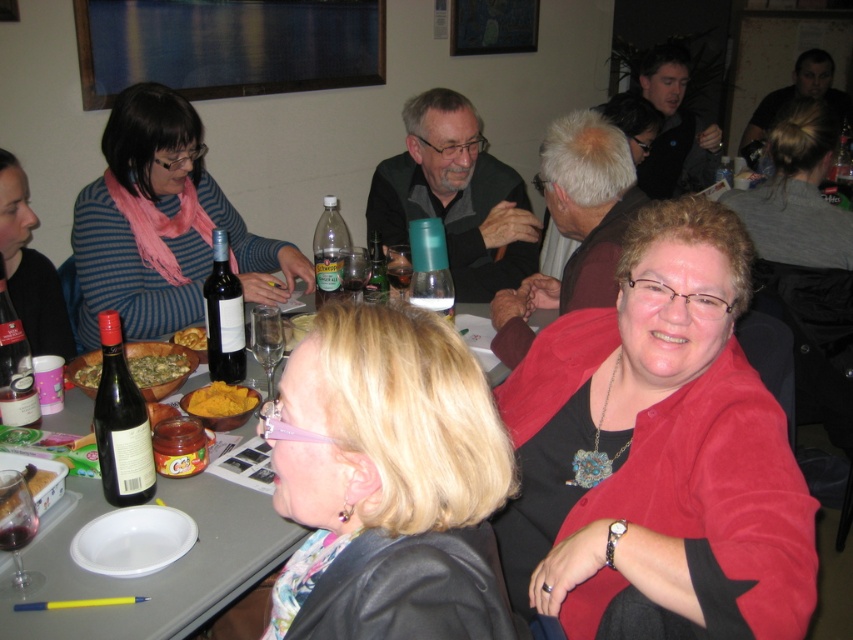
You are a guest at the dinner party and need to place a small note on the table without blocking any dishes. Which object, the red velvet sweater at lower right or the yellow matte bowl at lower left, would be a better choice for placing the note?

The yellow matte bowl at lower left is a better choice because the red velvet sweater at lower right is larger and might block more space, whereas the yellow matte bowl at lower left is smaller and less likely to obstruct dishes.

You are a guest at this dinner party and want to reach for the green matte bowl at center without disturbing the red velvet sweater at lower right. Is the sweater in your way?

The red velvet sweater at lower right is in front of the green matte bowl at center, so yes, the sweater is blocking your access to the bowl.